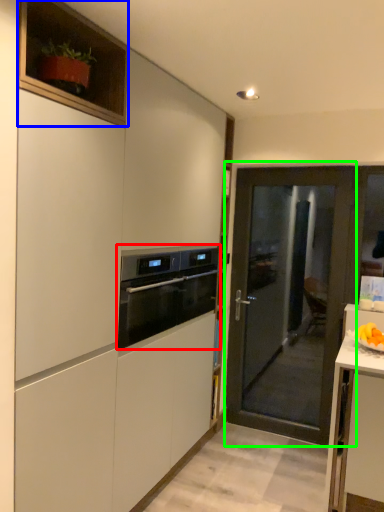
Question: Which object is positioned closest to kitchen appliance (highlighted by a red box)? Select from cabinetry (highlighted by a blue box) and door (highlighted by a green box).

Choices:
 (A) cabinetry
 (B) door

Answer: (A)